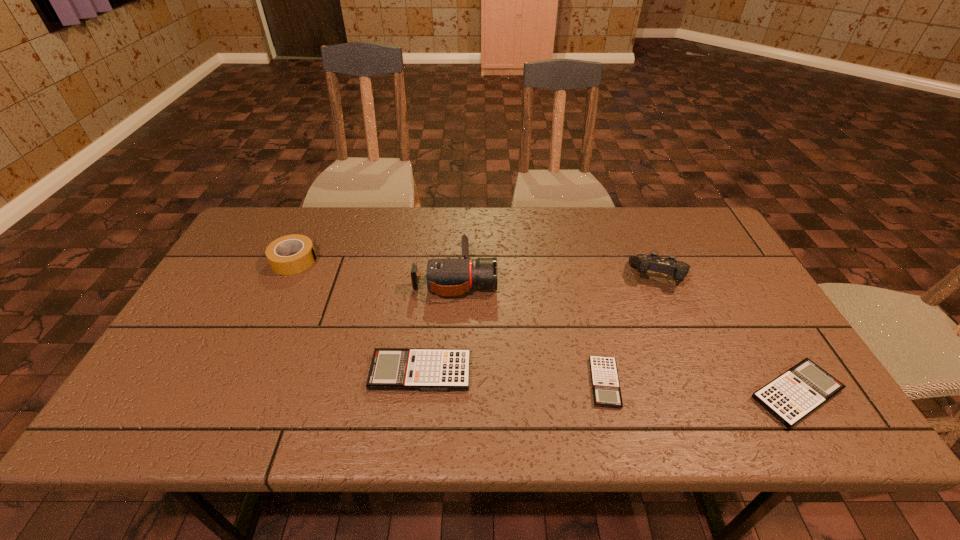
Please point a spot to add another calculator on the left. Please provide its 2D coordinates. Your answer should be formatted as a tuple, i.e. [(x, y)], where the tuple contains the x and y coordinates of a point satisfying the conditions above.

[(244, 362)]